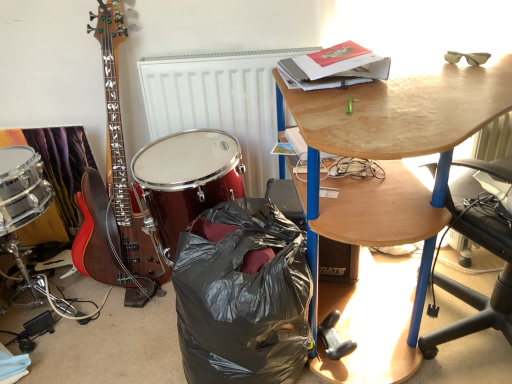
Question: Is black plastic bag at lower center at the right side of black plastic loudspeaker at lower center?

Choices:
 (A) yes
 (B) no

Answer: (B)

Question: Would you say black plastic bag at lower center is a long distance from black plastic loudspeaker at lower center?

Choices:
 (A) yes
 (B) no

Answer: (B)

Question: From the image's perspective, does black plastic bag at lower center appear lower than black plastic loudspeaker at lower center?

Choices:
 (A) no
 (B) yes

Answer: (B)

Question: Does black plastic bag at lower center have a larger size compared to black plastic loudspeaker at lower center?

Choices:
 (A) no
 (B) yes

Answer: (B)

Question: Would you say black plastic bag at lower center contains black plastic loudspeaker at lower center?

Choices:
 (A) yes
 (B) no

Answer: (B)

Question: Is black plastic bag at lower center inside the boundaries of white textured radiator at center, or outside?

Choices:
 (A) inside
 (B) outside

Answer: (B)

Question: Considering their positions, is black plastic bag at lower center located in front of or behind white textured radiator at center?

Choices:
 (A) front
 (B) behind

Answer: (A)

Question: Considering the positions of black plastic bag at lower center and white textured radiator at center in the image, is black plastic bag at lower center bigger or smaller than white textured radiator at center?

Choices:
 (A) small
 (B) big

Answer: (B)

Question: Based on their positions, is black plastic bag at lower center located to the left or right of white textured radiator at center?

Choices:
 (A) left
 (B) right

Answer: (B)

Question: In terms of height, does white textured radiator at center look taller or shorter compared to shiny red drum at center?

Choices:
 (A) short
 (B) tall

Answer: (B)

Question: Considering the positions of white textured radiator at center and shiny red drum at center in the image, is white textured radiator at center bigger or smaller than shiny red drum at center?

Choices:
 (A) big
 (B) small

Answer: (B)

Question: From a real-world perspective, is white textured radiator at center physically located above or below shiny red drum at center?

Choices:
 (A) above
 (B) below

Answer: (A)

Question: In the image, is white textured radiator at center positioned in front of or behind shiny red drum at center?

Choices:
 (A) front
 (B) behind

Answer: (B)

Question: From the image's perspective, is shiny red drum at center above or below black plastic bag at lower center?

Choices:
 (A) below
 (B) above

Answer: (B)

Question: Is shiny red drum at center wider or thinner than black plastic bag at lower center?

Choices:
 (A) thin
 (B) wide

Answer: (A)